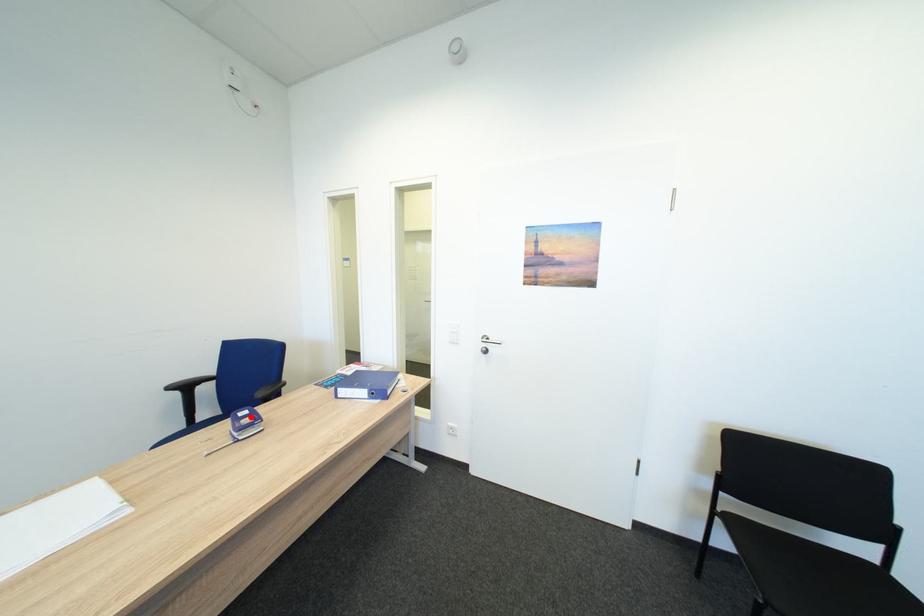
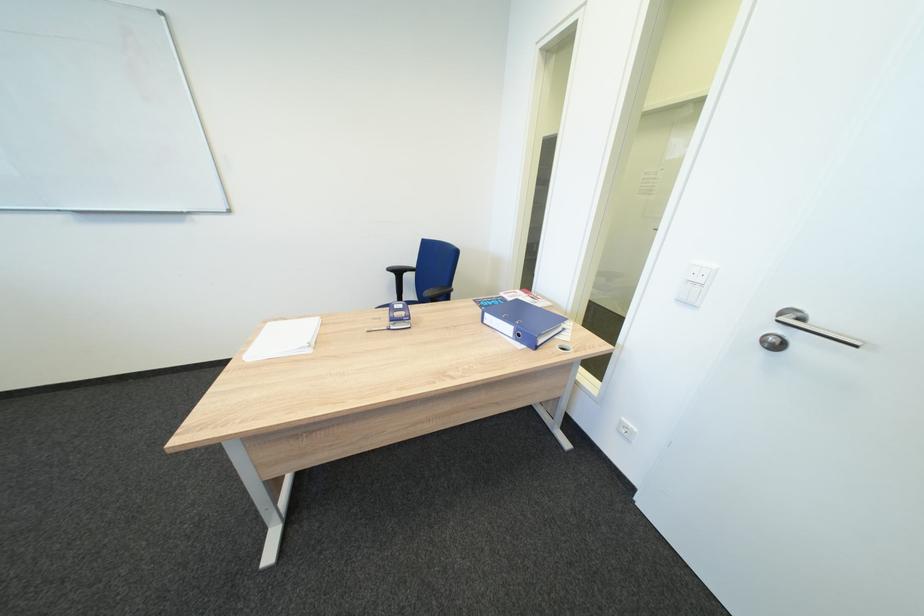
Where in the second image is the point corresponding to the highlighted location from the first image?

(407, 309)